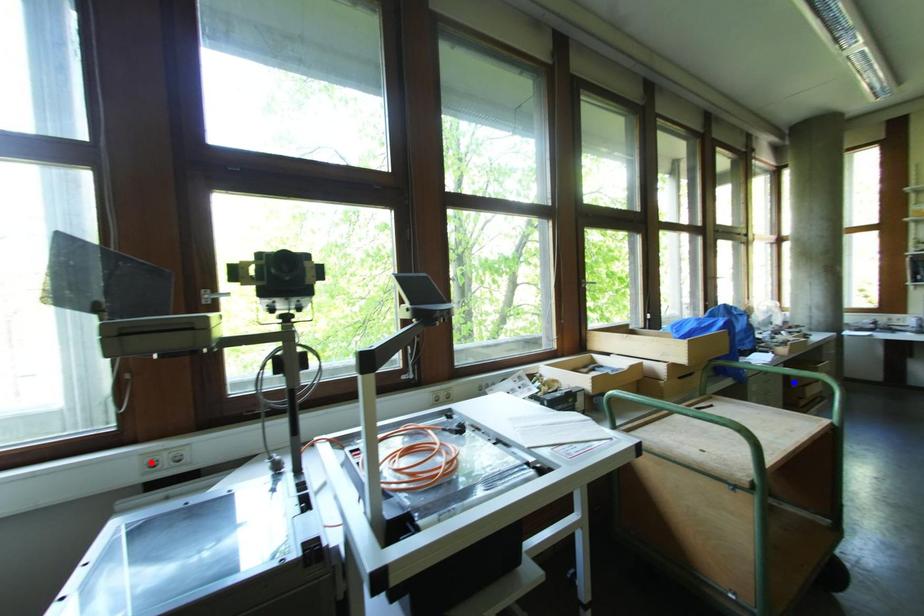
Question: Two points are marked on the image. Which point is closer to the camera?

Choices:
 (A) Blue point is closer.
 (B) Red point is closer.

Answer: (B)